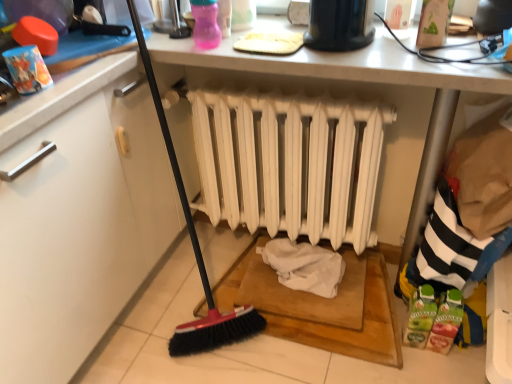
Question: Looking at the image, does black plastic toaster at upper center seem bigger or smaller compared to white matte radiator at center?

Choices:
 (A) big
 (B) small

Answer: (B)

Question: Relative to white matte radiator at center, is black plastic toaster at upper center in front or behind?

Choices:
 (A) behind
 (B) front

Answer: (B)

Question: Is black plastic toaster at upper center inside the boundaries of white matte radiator at center, or outside?

Choices:
 (A) inside
 (B) outside

Answer: (B)

Question: Relative to black plastic toaster at upper center, is white matte radiator at center in front or behind?

Choices:
 (A) front
 (B) behind

Answer: (B)

Question: From their relative heights in the image, would you say white matte radiator at center is taller or shorter than black plastic toaster at upper center?

Choices:
 (A) short
 (B) tall

Answer: (B)

Question: Would you say white matte radiator at center is inside or outside black plastic toaster at upper center?

Choices:
 (A) inside
 (B) outside

Answer: (B)

Question: Considering the positions of point (330, 163) and point (361, 9), is point (330, 163) closer or farther from the camera than point (361, 9)?

Choices:
 (A) farther
 (B) closer

Answer: (A)